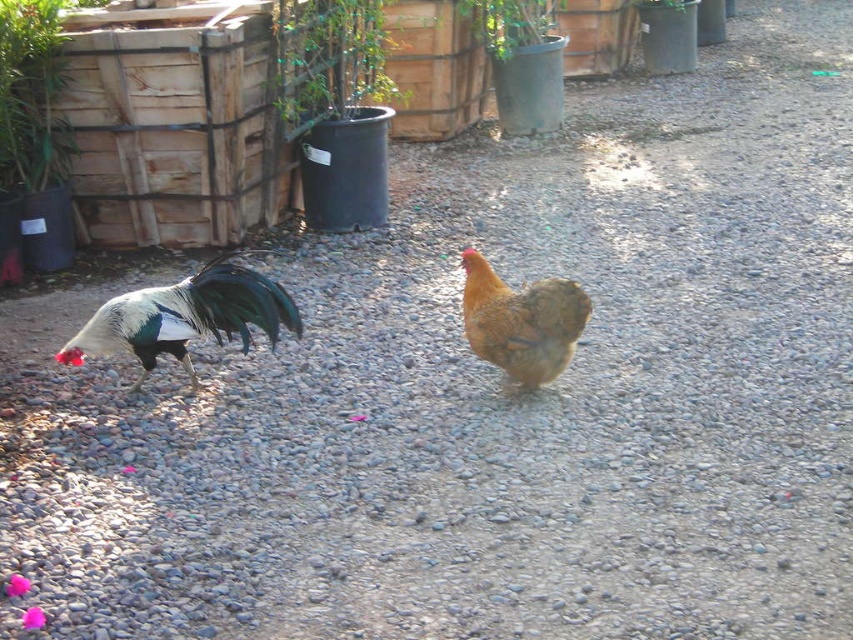
The width and height of the screenshot is (853, 640). In order to click on brown feathered chicken at center in this screenshot , I will do `click(521, 321)`.

You are a GUI agent. You are given a task and a screenshot of the screen. Output one action in this format:
    pyautogui.click(x=<x>, y=<y>)
    Task: Click on the brown feathered chicken at center
    The width and height of the screenshot is (853, 640).
    Given the screenshot: What is the action you would take?
    pyautogui.click(x=521, y=321)

Between point (236, 272) and point (502, 337), which one is positioned in front?

Point (236, 272)

From the picture: Is green glossy rooster at left bigger than brown feathered chicken at center?

Yes.

Describe the element at coordinates (186, 316) in the screenshot. I see `green glossy rooster at left` at that location.

Locate an element on the screen. green glossy rooster at left is located at coordinates (186, 316).

Which of these two, green leafy plant at upper center or green plastic pot at center, stands taller?

Standing taller between the two is green leafy plant at upper center.

Does green leafy plant at upper center come in front of green plastic pot at center?

Yes, green leafy plant at upper center is in front of green plastic pot at center.

Who is more forward, (312, 38) or (646, 8)?

Point (312, 38) is more forward.

Where is `green leafy plant at upper center`? green leafy plant at upper center is located at coordinates (329, 60).